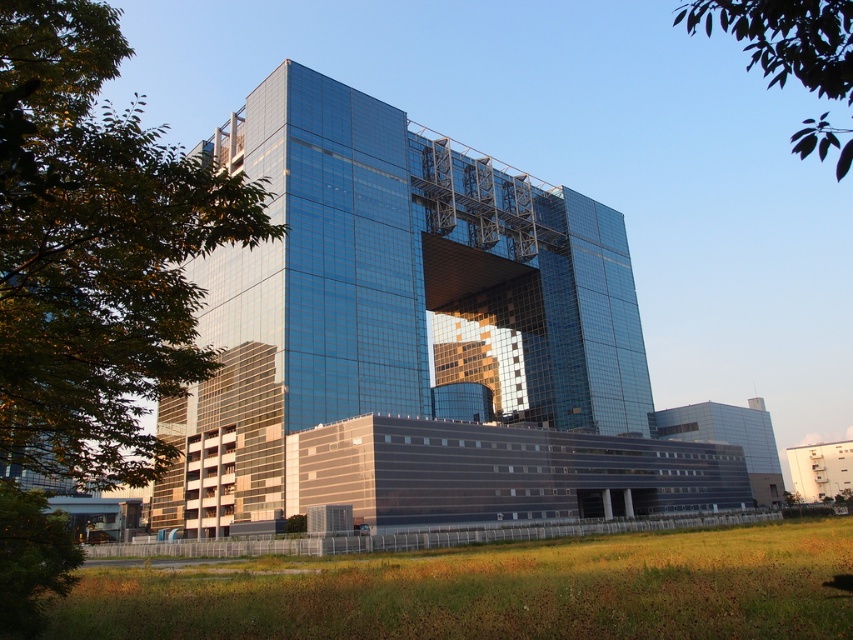
You are standing in front of the modern building and want to take a photo that includes both the green leafy tree at upper left and the green leafy tree at upper right. Which tree should you position closer to the center of your camera frame to ensure both are visible?

You should position the green leafy tree at upper left closer to the center of your camera frame because it is closer to the viewer than the green leafy tree at upper right, allowing both trees to be captured within the frame.

In the scene shown: You are standing at a certain point and want to know how far you are from the point marked as point (102, 52) in the image. Can you determine the distance?

The distance between you and point (102, 52) is 7.83 meters.

You are standing at the entrance of the modern building and want to locate the green leafy tree at upper left. According to the coordinates provided, where should you look relative to your position?

The green leafy tree at upper left is located at point coordinates 0.394 on the x axis and 0.113 on the y axis, so you should look towards the upper left direction from your current position at the entrance.